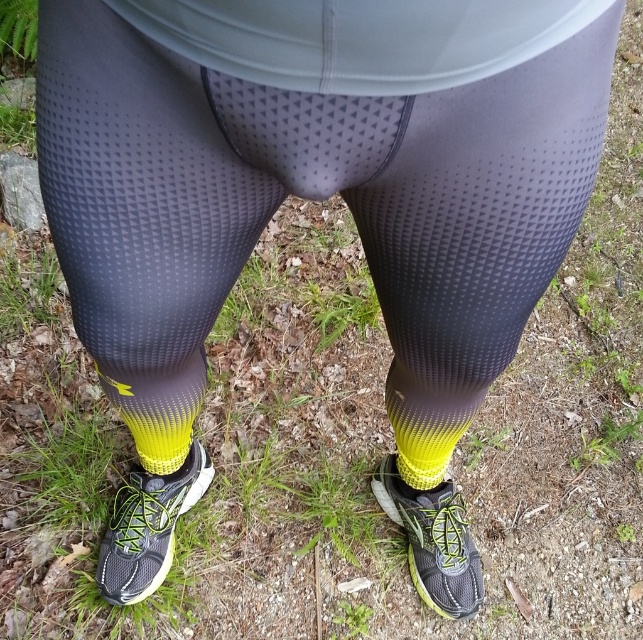
Is yellow mesh shoe at lower center smaller than yellow gradient fabric sock at lower center?

Yes.

This screenshot has width=643, height=640. In order to click on yellow mesh shoe at lower center in this screenshot , I will do `click(147, 528)`.

Is point (100, 579) positioned before point (406, 388)?

No, (100, 579) is behind (406, 388).

This screenshot has width=643, height=640. I want to click on yellow mesh shoe at lower center, so click(x=147, y=528).

Is yellow mesh shoe at lower center wider than matte black shoe at lower center?

Incorrect, yellow mesh shoe at lower center's width does not surpass matte black shoe at lower center's.

Is point (131, 513) farther from camera compared to point (428, 573)?

No, it is not.

This screenshot has width=643, height=640. Find the location of `yellow mesh shoe at lower center`. yellow mesh shoe at lower center is located at coordinates (147, 528).

Identify the location of yellow mesh shoe at lower center. The width and height of the screenshot is (643, 640). pyautogui.click(x=147, y=528).

Does matte black shoe at lower center appear on the left side of yellow gradient fabric sock at lower center?

Incorrect, matte black shoe at lower center is not on the left side of yellow gradient fabric sock at lower center.

Is point (444, 596) in front of point (460, 406)?

No, (444, 596) is behind (460, 406).

Describe the element at coordinates (433, 540) in the screenshot. I see `matte black shoe at lower center` at that location.

Find the location of a particular element. matte black shoe at lower center is located at coordinates (433, 540).